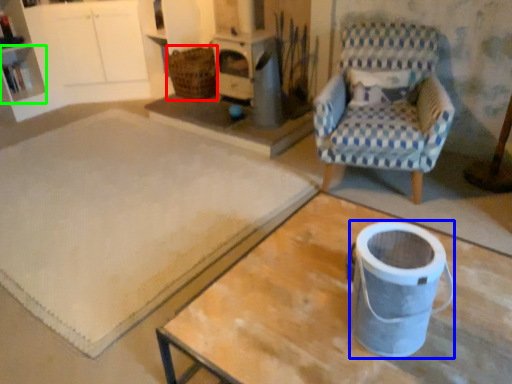
Question: Which object is the closest to the basket (highlighted by a red box)? Choose among these: appliance (highlighted by a blue box) or shelf (highlighted by a green box).

Choices:
 (A) appliance
 (B) shelf

Answer: (B)